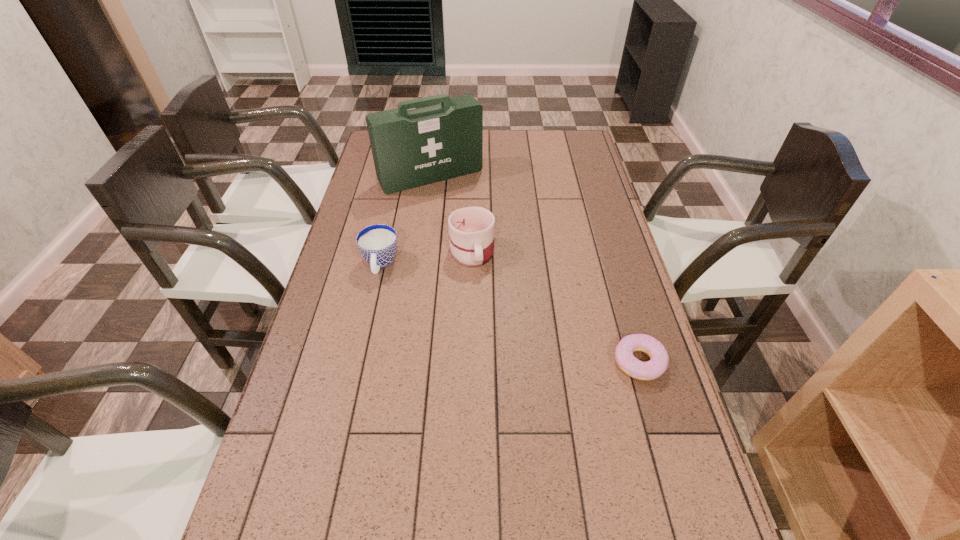
At what (x,y) coordinates should I click in order to perform the action: click on free space between the mug and the second shortest object. Please return your answer as a coordinate pair (x, y). Looking at the image, I should click on (426, 258).

I want to click on object that can be found as the third closest to the second shortest object, so click(x=657, y=365).

I want to click on the third closest object to the third tallest object, so click(657, 365).

This screenshot has height=540, width=960. I want to click on free spot that satisfies the following two spatial constraints: 1. on the side of the second shortest object with the handle; 2. on the right side of the rightmost object, so click(359, 362).